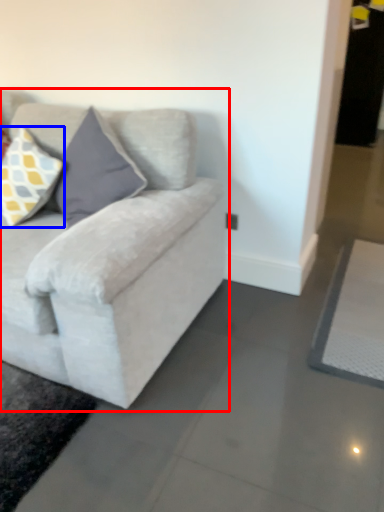
Question: Which point is closer to the camera, studio couch (highlighted by a red box) or pillow (highlighted by a blue box)?

Choices:
 (A) studio couch
 (B) pillow

Answer: (A)